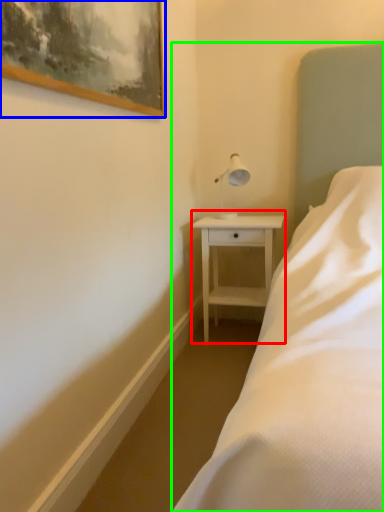
Question: Considering the real-world distances, which object is closest to nightstand (highlighted by a red box)? picture frame (highlighted by a blue box) or bed (highlighted by a green box).

Choices:
 (A) picture frame
 (B) bed

Answer: (B)